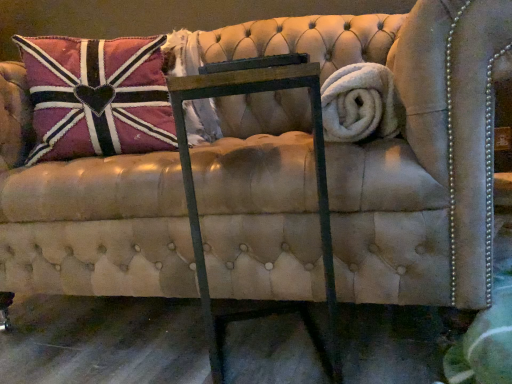
Question: Considering the positions of velvet union jack pillow at upper left and metal frame at center in the image, is velvet union jack pillow at upper left bigger or smaller than metal frame at center?

Choices:
 (A) small
 (B) big

Answer: (B)

Question: From the image's perspective, relative to metal frame at center, is velvet union jack pillow at upper left above or below?

Choices:
 (A) above
 (B) below

Answer: (A)

Question: Considering the real-world distances, which object is closest to the metal frame at center?

Choices:
 (A) velvet union jack pillow at upper left
 (B) white fluffy bath towel at right

Answer: (B)

Question: Based on their relative distances, which object is nearer to the velvet union jack pillow at upper left?

Choices:
 (A) white fluffy bath towel at right
 (B) metal frame at center

Answer: (B)